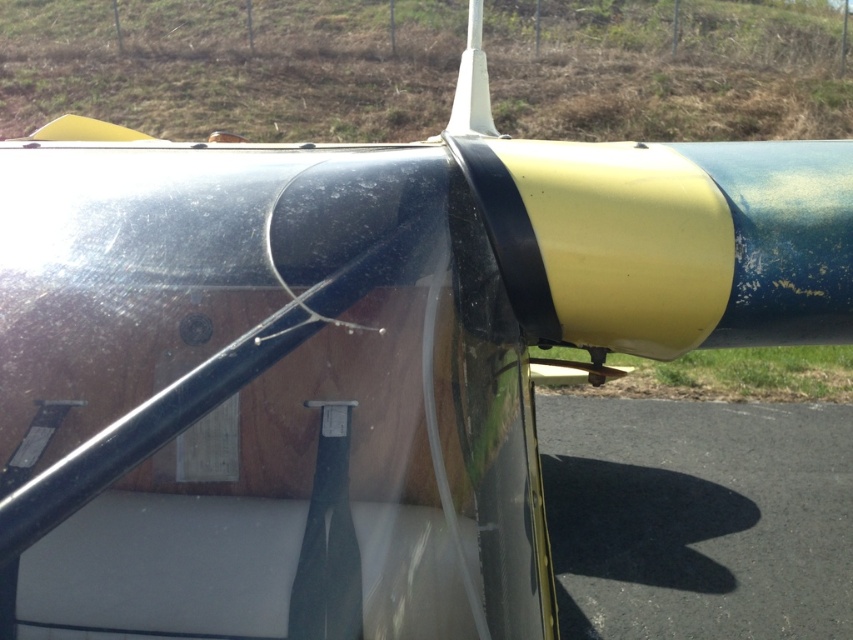
Question: Is dry grass at upper center closer to the viewer compared to black asphalt at lower right?

Choices:
 (A) no
 (B) yes

Answer: (A)

Question: Which of the following is the farthest from the observer?

Choices:
 (A) (415, 125)
 (B) (674, 621)

Answer: (A)

Question: Does dry grass at upper center have a greater width compared to black asphalt at lower right?

Choices:
 (A) yes
 (B) no

Answer: (A)

Question: Can you confirm if dry grass at upper center is positioned to the right of black asphalt at lower right?

Choices:
 (A) no
 (B) yes

Answer: (A)